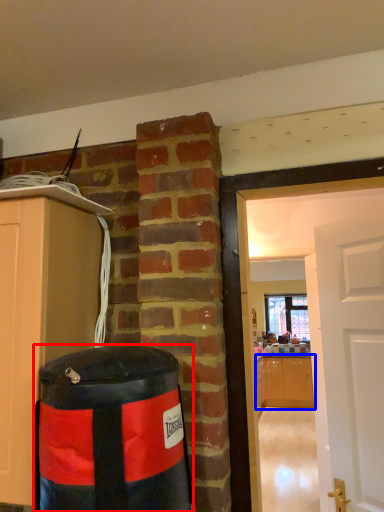
Question: Among these objects, which one is farthest to the camera, punching bag (highlighted by a red box) or cabinetry (highlighted by a blue box)?

Choices:
 (A) punching bag
 (B) cabinetry

Answer: (B)